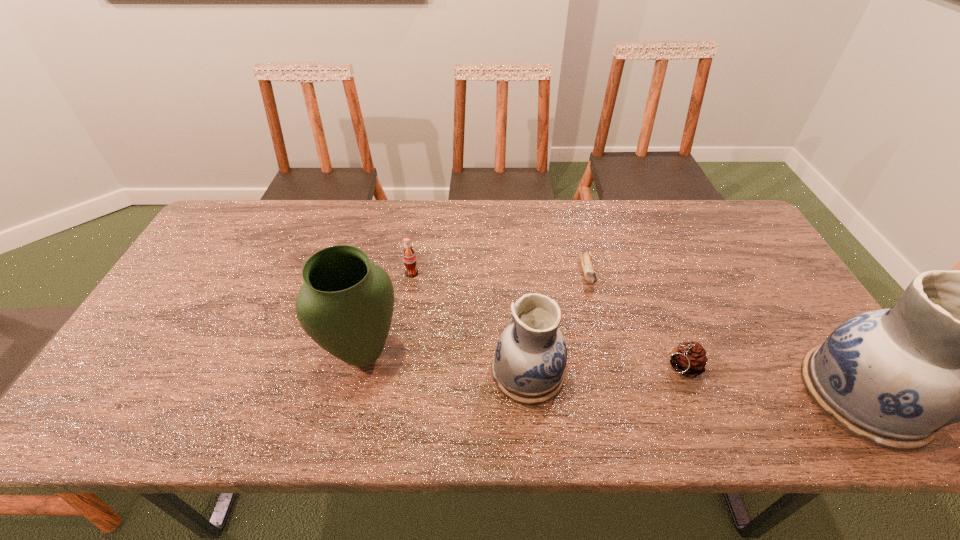
You are a GUI agent. You are given a task and a screenshot of the screen. Output one action in this format:
    pyautogui.click(x=<x>, y=<y>)
    Task: Click on the third tallest object
    
    Given the screenshot: What is the action you would take?
    pyautogui.click(x=529, y=364)

Find the location of a particular element. The image size is (960, 540). the third object from left to right is located at coordinates (529, 364).

Image resolution: width=960 pixels, height=540 pixels. I want to click on soda, so click(x=409, y=257).

You are a GUI agent. You are given a task and a screenshot of the screen. Output one action in this format:
    pyautogui.click(x=<x>, y=<y>)
    Task: Click on the banana
    The image size is (960, 540).
    Given the screenshot: What is the action you would take?
    pyautogui.click(x=589, y=273)

At what (x,y) coordinates should I click in order to perform the action: click on the second object from right to left. Please return your answer as a coordinate pair (x, y). Image resolution: width=960 pixels, height=540 pixels. Looking at the image, I should click on (689, 359).

Identify the location of the fifth shortest object. The width and height of the screenshot is (960, 540). (345, 305).

Find the location of `vacant space situated 0.400m on the left of the third object from left to right`. vacant space situated 0.400m on the left of the third object from left to right is located at coordinates (324, 372).

What are the coordinates of `free space located on the front of the third shortest object` in the screenshot? It's located at (407, 301).

In order to click on free space located at the stem of the banana in this screenshot , I will do `click(607, 354)`.

You are a GUI agent. You are given a task and a screenshot of the screen. Output one action in this format:
    pyautogui.click(x=<x>, y=<y>)
    Task: Click on the blank space located with a leaf charm attached to the pinecone
    
    Given the screenshot: What is the action you would take?
    [x=544, y=367]